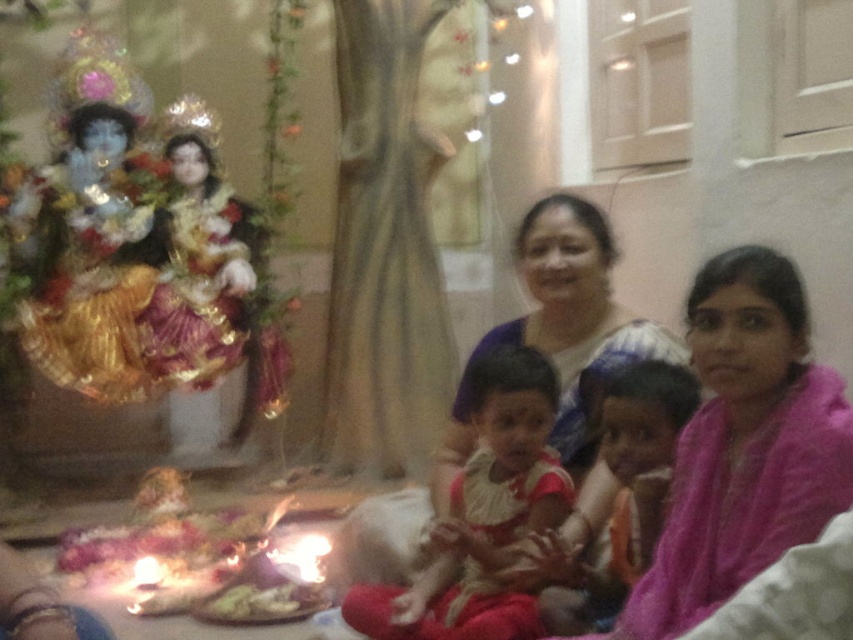
Question: Which object is positioned farthest from the pink fabric at center?

Choices:
 (A) matte white dress at center
 (B) matte pink dress at center

Answer: (A)

Question: Is pink fabric at center smaller than matte pink dress at center?

Choices:
 (A) no
 (B) yes

Answer: (A)

Question: Is pink fabric at center positioned behind matte pink dress at center?

Choices:
 (A) yes
 (B) no

Answer: (B)

Question: Is pink fabric at center above matte white dress at center?

Choices:
 (A) no
 (B) yes

Answer: (B)

Question: Among these points, which one is farthest from the camera?

Choices:
 (A) (614, 529)
 (B) (419, 589)

Answer: (B)

Question: Which of these objects is positioned farthest from the pink fabric at center?

Choices:
 (A) matte pink dress at center
 (B) matte white dress at center

Answer: (B)